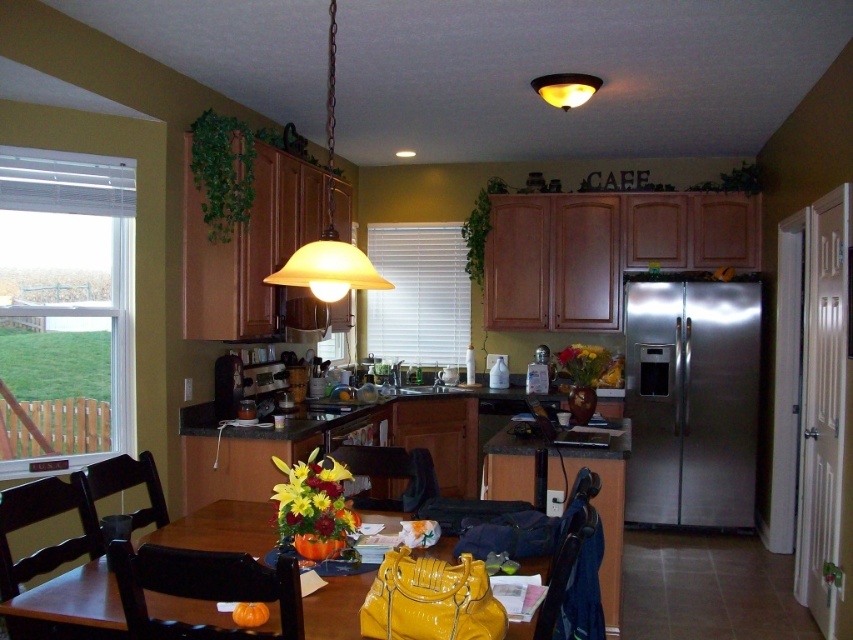
Looking at this image, you are a chef who wants to place a new recipe book on the counter near the stainless steel refrigerator at right so that it is under the matte yellow glass pendant light at upper center. Is this possible?

The stainless steel refrigerator at right is located below the matte yellow glass pendant light at upper center, so placing the recipe book on the counter near the refrigerator would indeed position it under the pendant light.

You are trying to decide whether to place a tall plant next to the stainless steel refrigerator at right or under the matte yellow glass pendant light at upper center. Based on their heights, which location would allow the plant to fit without touching the ceiling?

The stainless steel refrigerator at right is much taller than the matte yellow glass pendant light at upper center, so placing the tall plant next to the stainless steel refrigerator at right would be better to avoid touching the ceiling since it has more vertical space.

You are sitting at the black wood chair at left and want to reach the matte glass pendant light at upper center to adjust its brightness. Can you physically touch the pendant light from your current position?

The matte glass pendant light at upper center is closer to the viewer than the black wood chair at left, meaning it is physically nearer. However, since the pendant light is located above the chair, you would need to stand or use a tool to reach it from the chair.